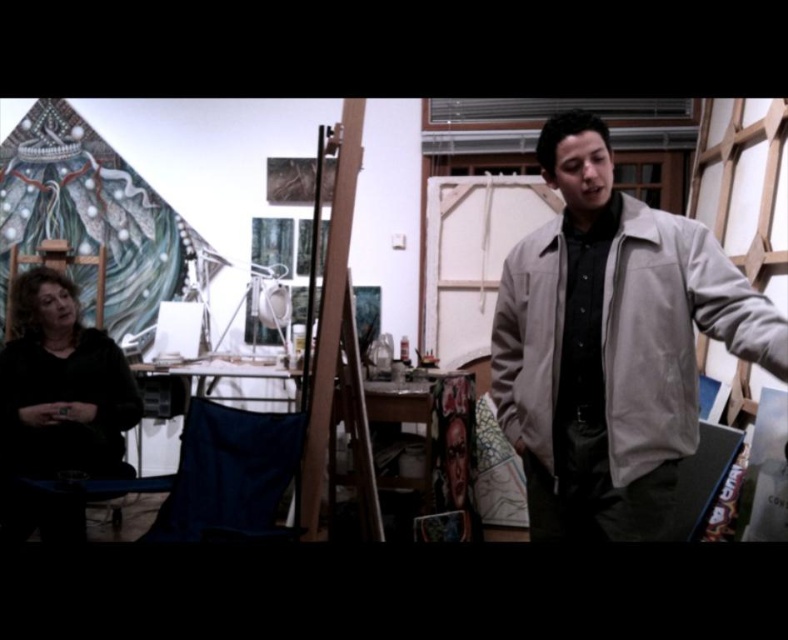
Question: Is the position of light beige jacket at center less distant than that of wooden easel at center?

Choices:
 (A) yes
 (B) no

Answer: (A)

Question: In this image, where is light beige jacket at center located relative to wooden easel at center?

Choices:
 (A) below
 (B) above

Answer: (B)

Question: Based on their relative distances, which object is farther from the light beige jacket at center?

Choices:
 (A) wooden easel at center
 (B) black matte shirt at lower left

Answer: (B)

Question: Which is nearer to the wooden easel at center?

Choices:
 (A) black matte shirt at lower left
 (B) light beige jacket at center

Answer: (B)

Question: Which of the following is the farthest from the observer?

Choices:
 (A) (500, 400)
 (B) (314, 525)
 (C) (93, 394)

Answer: (C)

Question: Does light beige jacket at center appear over black matte shirt at lower left?

Choices:
 (A) yes
 (B) no

Answer: (A)